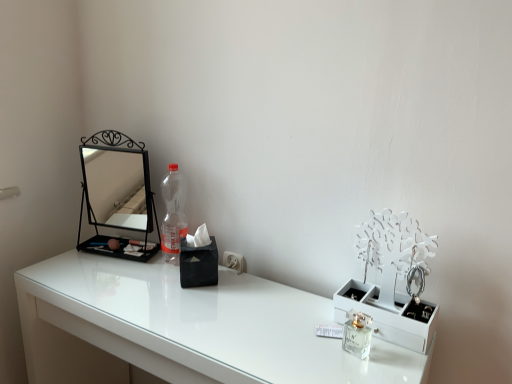
Question: From a real-world perspective, is white glossy table at center on top of clear glass perfume at center?

Choices:
 (A) no
 (B) yes

Answer: (A)

Question: From a real-world perspective, is white glossy table at center positioned under clear glass perfume at center based on gravity?

Choices:
 (A) no
 (B) yes

Answer: (B)

Question: Does white glossy table at center appear on the right side of clear glass perfume at center?

Choices:
 (A) no
 (B) yes

Answer: (A)

Question: Is white glossy table at center facing away from clear glass perfume at center?

Choices:
 (A) no
 (B) yes

Answer: (A)

Question: From the image's perspective, does white glossy table at center appear higher than clear glass perfume at center?

Choices:
 (A) yes
 (B) no

Answer: (B)

Question: Can you confirm if white glossy table at center is smaller than clear glass perfume at center?

Choices:
 (A) no
 (B) yes

Answer: (A)

Question: Is white glossy table at center located outside black metal mirror at left?

Choices:
 (A) no
 (B) yes

Answer: (B)

Question: Are white glossy table at center and black metal mirror at left located far from each other?

Choices:
 (A) no
 (B) yes

Answer: (A)

Question: Does white glossy table at center have a greater height compared to black metal mirror at left?

Choices:
 (A) yes
 (B) no

Answer: (A)

Question: Can you confirm if white glossy table at center is smaller than black metal mirror at left?

Choices:
 (A) yes
 (B) no

Answer: (B)

Question: Is white glossy table at center oriented away from black metal mirror at left?

Choices:
 (A) yes
 (B) no

Answer: (B)

Question: Considering the relative sizes of white glossy table at center and black metal mirror at left in the image provided, is white glossy table at center thinner than black metal mirror at left?

Choices:
 (A) yes
 (B) no

Answer: (B)

Question: Could you tell me if clear glass perfume at center is facing white glossy table at center?

Choices:
 (A) no
 (B) yes

Answer: (A)